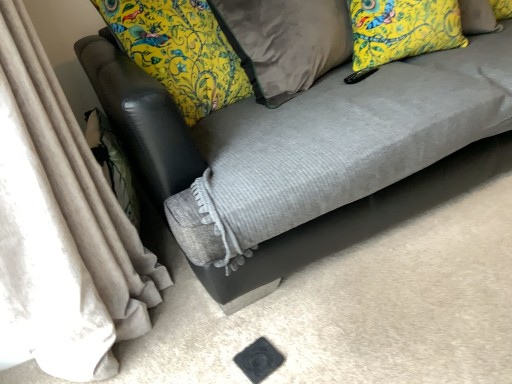
You are a GUI agent. You are given a task and a screenshot of the screen. Output one action in this format:
    pyautogui.click(x=<x>, y=<y>)
    Task: Click on the vacant region to the right of velvet gray curtain at left
    Image resolution: width=512 pixels, height=384 pixels.
    Given the screenshot: What is the action you would take?
    pyautogui.click(x=227, y=322)